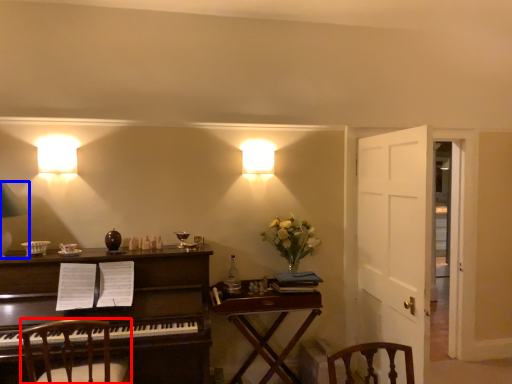
Question: Which of the following is the closest to the observer, chair (highlighted by a red box) or lamp (highlighted by a blue box)?

Choices:
 (A) chair
 (B) lamp

Answer: (A)